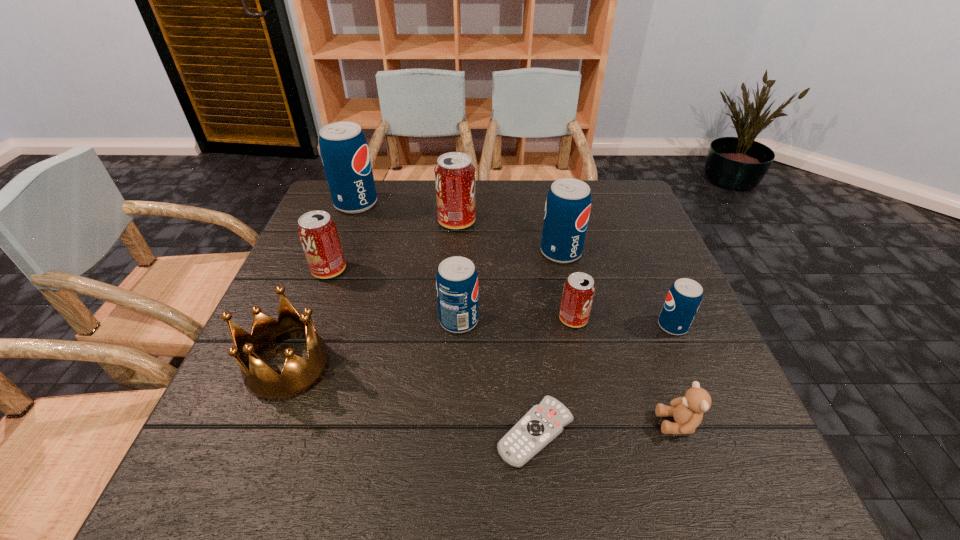
The width and height of the screenshot is (960, 540). Identify the location of the farthest blue pop. (344, 150).

Where is `the biggest blue pop`? This screenshot has width=960, height=540. the biggest blue pop is located at coordinates (344, 150).

Find the location of a particular element. The image size is (960, 540). the third smallest blue pop is located at coordinates (567, 209).

The width and height of the screenshot is (960, 540). I want to click on the second blue pop from right to left, so click(x=567, y=209).

Identify the location of the biggest red soda can. (454, 173).

Where is `the second red soda can from left to right`? Image resolution: width=960 pixels, height=540 pixels. the second red soda can from left to right is located at coordinates (454, 173).

Where is `the second biggest red soda can`? The height and width of the screenshot is (540, 960). the second biggest red soda can is located at coordinates (317, 231).

What are the coordinates of `the leftmost red soda can` in the screenshot? It's located at (317, 231).

The image size is (960, 540). Identify the location of the second smallest blue pop. (456, 279).

The image size is (960, 540). In order to click on crown in this screenshot , I will do pos(299,375).